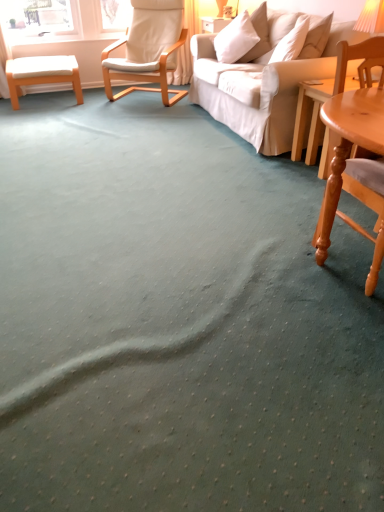
Question: From a real-world perspective, is orange fabric lampshade at upper right positioned above or below orange wood stool at left?

Choices:
 (A) above
 (B) below

Answer: (A)

Question: Based on their positions, is orange fabric lampshade at upper right located to the left or right of orange wood stool at left?

Choices:
 (A) left
 (B) right

Answer: (B)

Question: Which object is positioned farthest from the light wood chair at right, positioned as the first chair in front-to-back order?

Choices:
 (A) white fabric chair at upper left, the first chair from the left
 (B) orange fabric lampshade at upper right
 (C) light brown wooden coffee table at right
 (D) white soft pillow at upper right
 (E) orange wood stool at left

Answer: (E)

Question: Which object is the farthest from the white fabric chair at upper left, which ranks as the 2th chair in front-to-back order?

Choices:
 (A) light brown wooden coffee table at right
 (B) orange fabric lampshade at upper right
 (C) orange wood stool at left
 (D) white soft pillow at upper right
 (E) light wood chair at right, the 2th chair viewed from the left

Answer: (E)